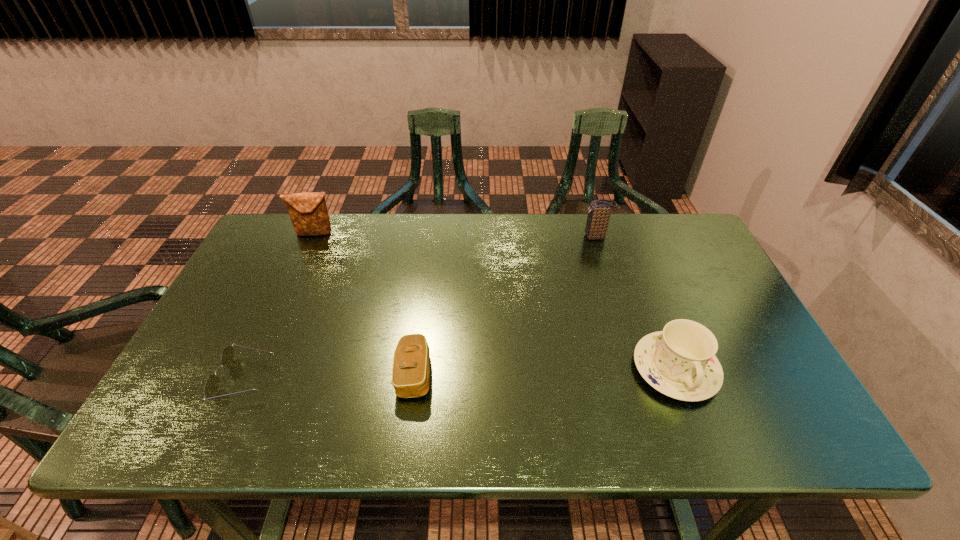
This screenshot has height=540, width=960. In order to click on vacant space located on the handle side of the third shortest object in this screenshot , I will do `click(702, 436)`.

Locate an element on the screen. free point located 0.190m on the zipper side of the nearest clutch bag is located at coordinates (513, 374).

Identify the location of blank space located on the front-facing side of the spectacles. This screenshot has height=540, width=960. (416, 379).

Locate an element on the screen. The height and width of the screenshot is (540, 960). chinaware located at the near edge is located at coordinates (680, 362).

I want to click on spectacles located in the near edge section of the desktop, so click(x=211, y=388).

Image resolution: width=960 pixels, height=540 pixels. What are the coordinates of `clutch bag at the left edge` in the screenshot? It's located at (308, 212).

I want to click on spectacles positioned at the left edge, so click(x=211, y=388).

Locate an element on the screen. object positioned at the right edge is located at coordinates (680, 362).

Where is `object that is at the far left corner`? The width and height of the screenshot is (960, 540). object that is at the far left corner is located at coordinates (308, 212).

At what (x,y) coordinates should I click in order to perform the action: click on object at the near left corner. Please return your answer as a coordinate pair (x, y). The image size is (960, 540). Looking at the image, I should click on (211, 388).